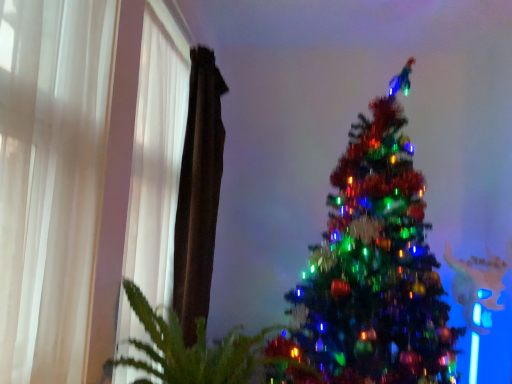
Image resolution: width=512 pixels, height=384 pixels. What do you see at coordinates (375, 266) in the screenshot? I see `shiny green christmas tree at center` at bounding box center [375, 266].

The height and width of the screenshot is (384, 512). Describe the element at coordinates (51, 180) in the screenshot. I see `white sheer curtain at left, which is counted as the 3th curtain, starting from the back` at that location.

Where is `white sheer curtain at left, arranged as the second curtain when viewed from the back`? white sheer curtain at left, arranged as the second curtain when viewed from the back is located at coordinates (157, 151).

Which object is positioned more to the left, green leafy plant at lower left or white sheer curtain at left, marked as the 2th curtain in a front-to-back arrangement?

Positioned to the left is white sheer curtain at left, marked as the 2th curtain in a front-to-back arrangement.

Is green leafy plant at lower left facing towards white sheer curtain at left, marked as the 2th curtain in a front-to-back arrangement?

No.

Which of these two, green leafy plant at lower left or white sheer curtain at left, marked as the 2th curtain in a front-to-back arrangement, is thinner?

With smaller width is white sheer curtain at left, marked as the 2th curtain in a front-to-back arrangement.

Is the depth of green leafy plant at lower left less than that of white sheer curtain at left, marked as the 2th curtain in a front-to-back arrangement?

That is True.

Can you confirm if green leafy plant at lower left is shorter than brown fabric curtain at left, the third curtain in the front-to-back sequence?

Yes.

Are green leafy plant at lower left and brown fabric curtain at left, the first curtain viewed from the back, making contact?

No, green leafy plant at lower left is not touching brown fabric curtain at left, the first curtain viewed from the back.

Which curtain is the 2nd one when counting from the back of the green leafy plant at lower left? Please provide its 2D coordinates.

[(198, 193)]

Based on the photo, which point is more forward, (179, 374) or (209, 289)?

Point (179, 374)

Is the depth of white sheer curtain at left, which is the first curtain from front to back, greater than that of white sheer curtain at left, arranged as the second curtain when viewed from the back?

No, white sheer curtain at left, which is the first curtain from front to back, is closer to the viewer.

Would you say white sheer curtain at left, which is counted as the 3th curtain, starting from the back, is outside white sheer curtain at left, arranged as the second curtain when viewed from the back?

white sheer curtain at left, which is counted as the 3th curtain, starting from the back, lies outside white sheer curtain at left, arranged as the second curtain when viewed from the back,'s area.

You are a GUI agent. You are given a task and a screenshot of the screen. Output one action in this format:
    pyautogui.click(x=<x>, y=<y>)
    Task: Click on the curtain that is the 1st one when counting rightward from the white sheer curtain at left, which is the first curtain from front to back
    
    Given the screenshot: What is the action you would take?
    pyautogui.click(x=157, y=151)

How many degrees apart are the facing directions of white sheer curtain at left, which is the first curtain from front to back, and white sheer curtain at left, marked as the 2th curtain in a front-to-back arrangement?

There is a 0.00083-degree angle between the facing directions of white sheer curtain at left, which is the first curtain from front to back, and white sheer curtain at left, marked as the 2th curtain in a front-to-back arrangement.

Is brown fabric curtain at left, the first curtain viewed from the back, directly adjacent to shiny green christmas tree at center?

No.

Do you think brown fabric curtain at left, the third curtain in the front-to-back sequence, is within shiny green christmas tree at center, or outside of it?

brown fabric curtain at left, the third curtain in the front-to-back sequence, exists outside the volume of shiny green christmas tree at center.

From the picture: From the image's perspective, who appears lower, brown fabric curtain at left, the first curtain viewed from the back, or shiny green christmas tree at center?

shiny green christmas tree at center is shown below in the image.

Is shiny green christmas tree at center facing away from green leafy plant at lower left?

No, green leafy plant at lower left is not at the back of shiny green christmas tree at center.

From the image's perspective, is shiny green christmas tree at center on top of green leafy plant at lower left?

Yes, from the image's perspective, shiny green christmas tree at center is on top of green leafy plant at lower left.

Consider the image. Would you say green leafy plant at lower left is part of shiny green christmas tree at center's contents?

No, green leafy plant at lower left is not a part of shiny green christmas tree at center.

Does point (364, 161) lie in front of point (147, 351)?

No.

Relative to shiny green christmas tree at center, is green leafy plant at lower left in front or behind?

green leafy plant at lower left is positioned closer to the viewer than shiny green christmas tree at center.

Is point (214, 356) positioned before point (377, 236)?

Yes.

Which object is positioned more to the left, green leafy plant at lower left or shiny green christmas tree at center?

green leafy plant at lower left.

Can you tell me how much green leafy plant at lower left and shiny green christmas tree at center differ in facing direction?

87.3 degrees.

Is white sheer curtain at left, which is counted as the 3th curtain, starting from the back, with shiny green christmas tree at center?

No, white sheer curtain at left, which is counted as the 3th curtain, starting from the back, is not beside shiny green christmas tree at center.

Which object is more forward, white sheer curtain at left, which is counted as the 3th curtain, starting from the back, or shiny green christmas tree at center?

white sheer curtain at left, which is counted as the 3th curtain, starting from the back, is more forward.

Is white sheer curtain at left, which is counted as the 3th curtain, starting from the back, positioned with its back to shiny green christmas tree at center?

No, white sheer curtain at left, which is counted as the 3th curtain, starting from the back, is not facing away from shiny green christmas tree at center.

Does white sheer curtain at left, which is the first curtain from front to back, contain shiny green christmas tree at center?

Actually, shiny green christmas tree at center is outside white sheer curtain at left, which is the first curtain from front to back.

This screenshot has height=384, width=512. I want to click on plant that appears below the white sheer curtain at left, arranged as the second curtain when viewed from the back (from a real-world perspective), so click(191, 349).

Locate an element on the screen. The width and height of the screenshot is (512, 384). plant that appears on the right of brown fabric curtain at left, the first curtain viewed from the back is located at coordinates click(x=191, y=349).

Based on their spatial positions, is shiny green christmas tree at center or white sheer curtain at left, which is counted as the 3th curtain, starting from the back, further from white sheer curtain at left, arranged as the second curtain when viewed from the back?

shiny green christmas tree at center is positioned further to the anchor white sheer curtain at left, arranged as the second curtain when viewed from the back.

Based on their spatial positions, is shiny green christmas tree at center or white sheer curtain at left, marked as the 2th curtain in a front-to-back arrangement, further from brown fabric curtain at left, the third curtain in the front-to-back sequence?

Among the two, shiny green christmas tree at center is located further to brown fabric curtain at left, the third curtain in the front-to-back sequence.

Which object lies further to the anchor point white sheer curtain at left, which is the first curtain from front to back, green leafy plant at lower left or shiny green christmas tree at center?

shiny green christmas tree at center lies further to white sheer curtain at left, which is the first curtain from front to back, than the other object.

Estimate the real-world distances between objects in this image. Which object is further from brown fabric curtain at left, the first curtain viewed from the back, shiny green christmas tree at center or green leafy plant at lower left?

Based on the image, shiny green christmas tree at center appears to be further to brown fabric curtain at left, the first curtain viewed from the back.

Based on their spatial positions, is green leafy plant at lower left or white sheer curtain at left, which is the first curtain from front to back, closer to brown fabric curtain at left, the third curtain in the front-to-back sequence?

Among the two, green leafy plant at lower left is located nearer to brown fabric curtain at left, the third curtain in the front-to-back sequence.

Based on their spatial positions, is white sheer curtain at left, marked as the 2th curtain in a front-to-back arrangement, or green leafy plant at lower left further from shiny green christmas tree at center?

white sheer curtain at left, marked as the 2th curtain in a front-to-back arrangement, is positioned further to the anchor shiny green christmas tree at center.

Which object lies further to the anchor point green leafy plant at lower left, white sheer curtain at left, which is counted as the 3th curtain, starting from the back, or shiny green christmas tree at center?

shiny green christmas tree at center lies further to green leafy plant at lower left than the other object.

From the picture: Which object lies nearer to the anchor point white sheer curtain at left, which is the first curtain from front to back, green leafy plant at lower left or white sheer curtain at left, arranged as the second curtain when viewed from the back?

green leafy plant at lower left is closer to white sheer curtain at left, which is the first curtain from front to back.

Find the location of a particular element. This screenshot has width=512, height=384. plant between white sheer curtain at left, which is counted as the 3th curtain, starting from the back, and white sheer curtain at left, marked as the 2th curtain in a front-to-back arrangement, in the front-back direction is located at coordinates point(191,349).

Find the location of a particular element. This screenshot has width=512, height=384. curtain positioned between white sheer curtain at left, which is the first curtain from front to back, and brown fabric curtain at left, the first curtain viewed from the back, from near to far is located at coordinates (157, 151).

Identify the location of curtain between white sheer curtain at left, marked as the 2th curtain in a front-to-back arrangement, and shiny green christmas tree at center from left to right. (198, 193).

The width and height of the screenshot is (512, 384). Identify the location of plant situated between white sheer curtain at left, marked as the 2th curtain in a front-to-back arrangement, and shiny green christmas tree at center from left to right. (191, 349).